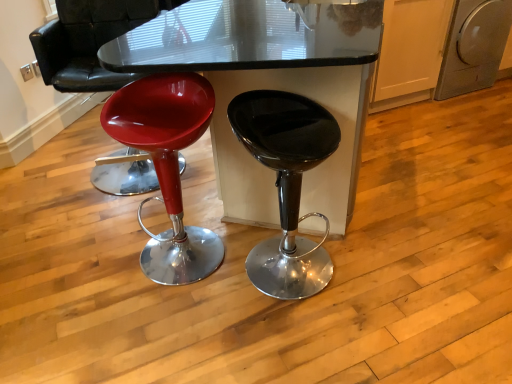
Question: Should I look upward or downward to see silver metallic dishwasher at right?

Choices:
 (A) up
 (B) down

Answer: (A)

Question: Is glossy glass table at center looking in the opposite direction of glossy plastic stool at left, the first stool viewed from the left?

Choices:
 (A) yes
 (B) no

Answer: (B)

Question: Is glossy glass table at center far from glossy plastic stool at left, which is the 2th stool in right-to-left order?

Choices:
 (A) no
 (B) yes

Answer: (B)

Question: Considering the relative sizes of glossy glass table at center and glossy plastic stool at left, the first stool viewed from the left, in the image provided, is glossy glass table at center smaller than glossy plastic stool at left, the first stool viewed from the left,?

Choices:
 (A) yes
 (B) no

Answer: (B)

Question: Does glossy glass table at center have a lesser width compared to glossy plastic stool at left, the first stool viewed from the left?

Choices:
 (A) no
 (B) yes

Answer: (A)

Question: Is glossy glass table at center surrounding glossy plastic stool at left, the first stool viewed from the left?

Choices:
 (A) no
 (B) yes

Answer: (B)

Question: Is glossy glass table at center taller than glossy plastic stool at left, which is the 2th stool in right-to-left order?

Choices:
 (A) yes
 (B) no

Answer: (A)

Question: Is glossy plastic stool at left not close to glossy plastic stool at left, which is the 2th stool in right-to-left order?

Choices:
 (A) no
 (B) yes

Answer: (A)

Question: Does glossy plastic stool at left have a lesser width compared to glossy plastic stool at left, the first stool viewed from the left?

Choices:
 (A) yes
 (B) no

Answer: (B)

Question: Is glossy plastic stool at left smaller than glossy plastic stool at left, the first stool viewed from the left?

Choices:
 (A) no
 (B) yes

Answer: (A)

Question: Is glossy plastic stool at left bigger than glossy plastic stool at left, which is the 2th stool in right-to-left order?

Choices:
 (A) yes
 (B) no

Answer: (A)

Question: Is glossy plastic stool at left facing away from glossy plastic stool at left, the first stool viewed from the left?

Choices:
 (A) no
 (B) yes

Answer: (A)

Question: From a real-world perspective, is glossy plastic stool at left on top of glossy plastic stool at left, the first stool viewed from the left?

Choices:
 (A) yes
 (B) no

Answer: (A)

Question: From the image's perspective, would you say glossy plastic stool at left, the first stool viewed from the left, is shown under silver metallic dishwasher at right?

Choices:
 (A) no
 (B) yes

Answer: (B)